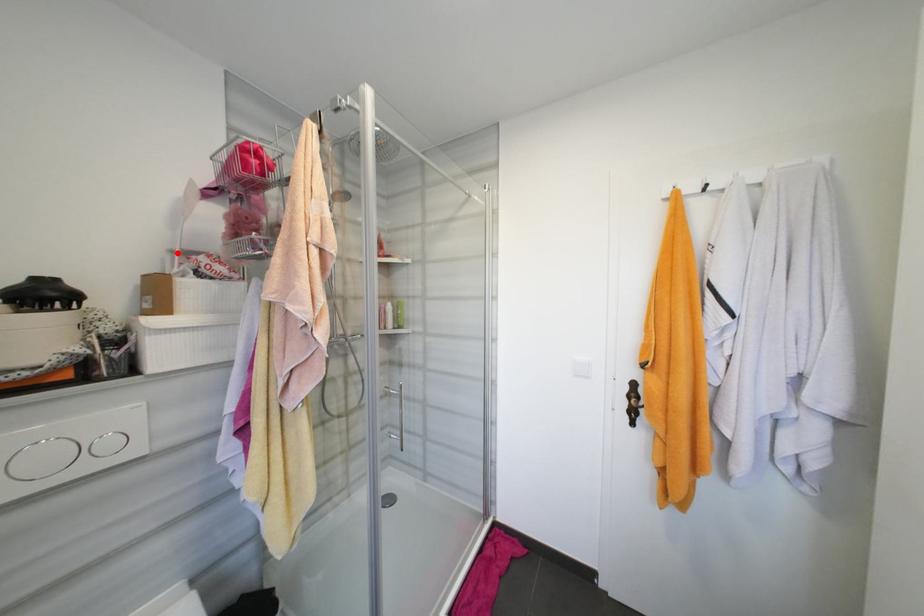
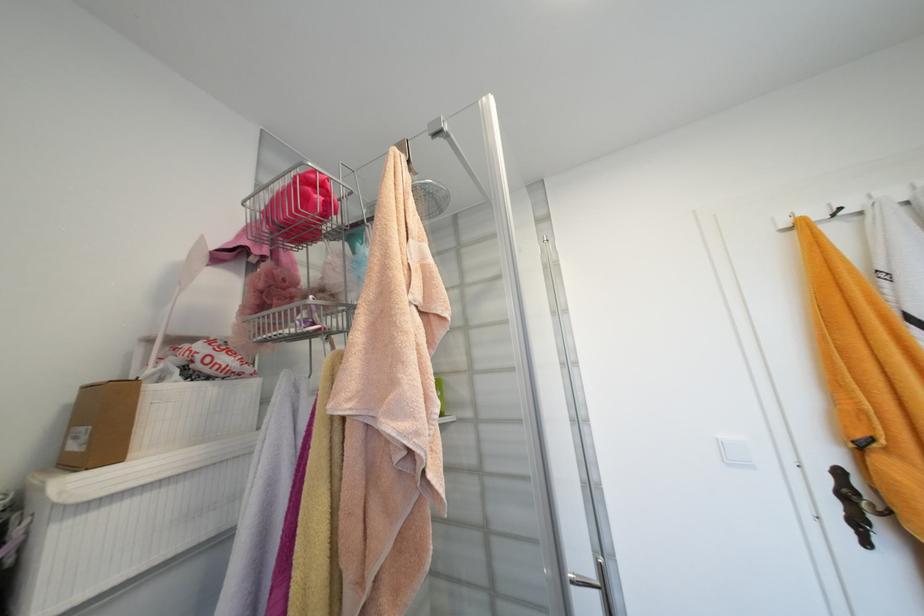
Locate, in the second image, the point that corresponds to the highlighted location in the first image.

(154, 342)